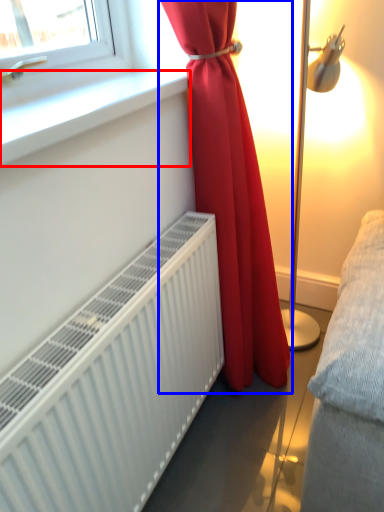
Question: Which of the following is the farthest to the observer, window sill (highlighted by a red box) or curtain (highlighted by a blue box)?

Choices:
 (A) window sill
 (B) curtain

Answer: (B)